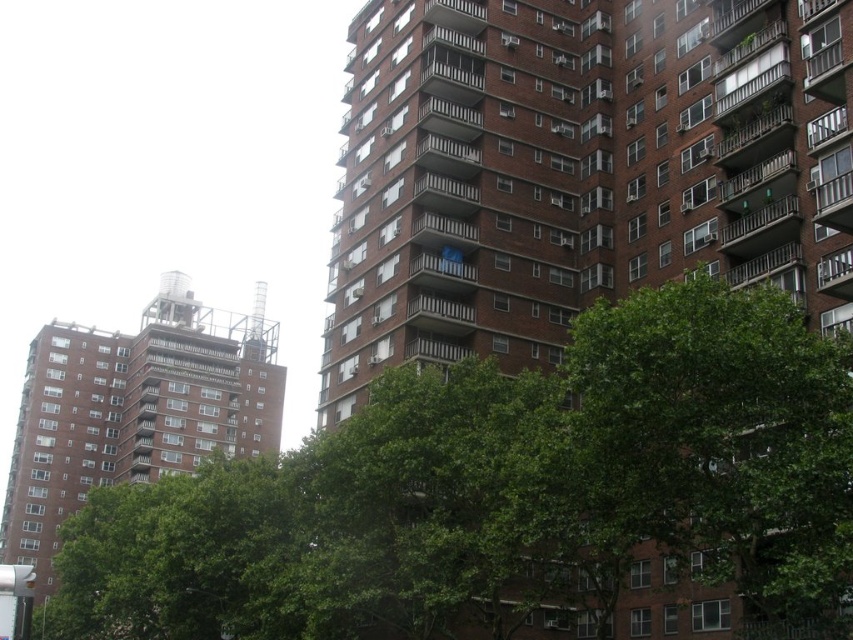
Question: Which of the following is the farthest from the observer?

Choices:
 (A) (822, 589)
 (B) (19, 508)
 (C) (677, 557)

Answer: (B)

Question: Which is farther from the green leafy tree at center?

Choices:
 (A) brown brick building at left
 (B) green leafy tree at lower left

Answer: (A)

Question: Can you confirm if green leafy tree at center is bigger than brown brick building at left?

Choices:
 (A) yes
 (B) no

Answer: (B)

Question: Is the position of green leafy tree at lower left more distant than that of green leafy tree at center?

Choices:
 (A) no
 (B) yes

Answer: (B)

Question: Based on their relative distances, which object is nearer to the green leafy tree at center?

Choices:
 (A) green leafy tree at lower left
 (B) brown brick building at left

Answer: (A)

Question: Is green leafy tree at lower left thinner than brown brick building at left?

Choices:
 (A) yes
 (B) no

Answer: (B)